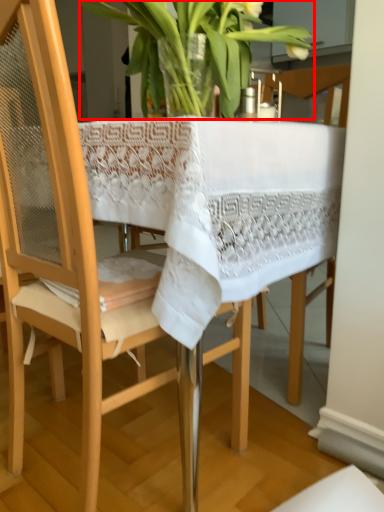
Question: Where is houseplant (annotated by the red box) located in relation to chair in the image?

Choices:
 (A) right
 (B) left

Answer: (A)